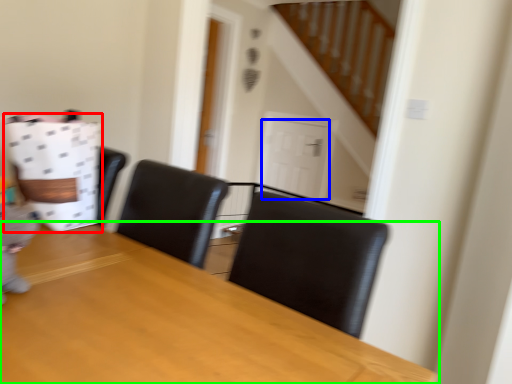
Question: Considering the real-world distances, which object is closest to paper bag (highlighted by a red box)? door (highlighted by a blue box) or table (highlighted by a green box).

Choices:
 (A) door
 (B) table

Answer: (B)